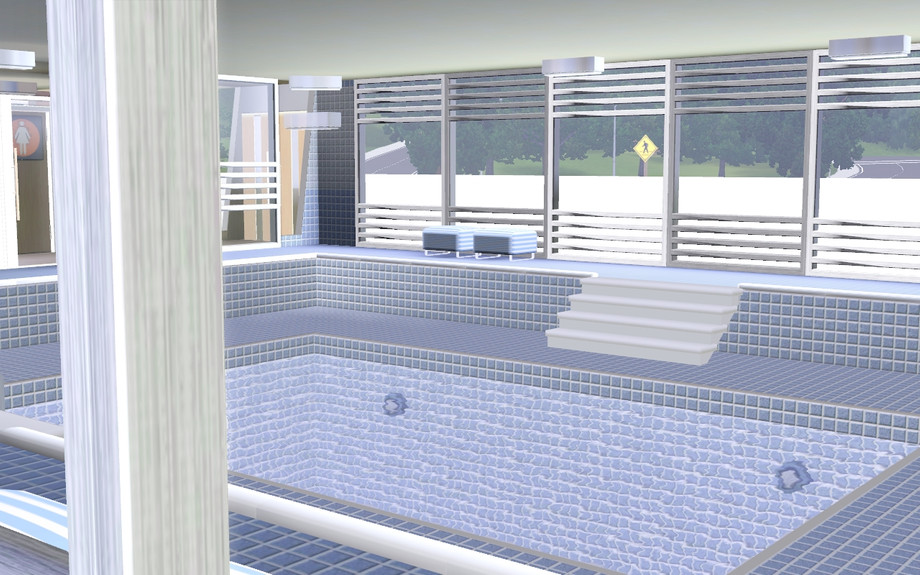
This screenshot has height=575, width=920. I want to click on light blue ottomans, so click(x=443, y=239), click(x=508, y=241).